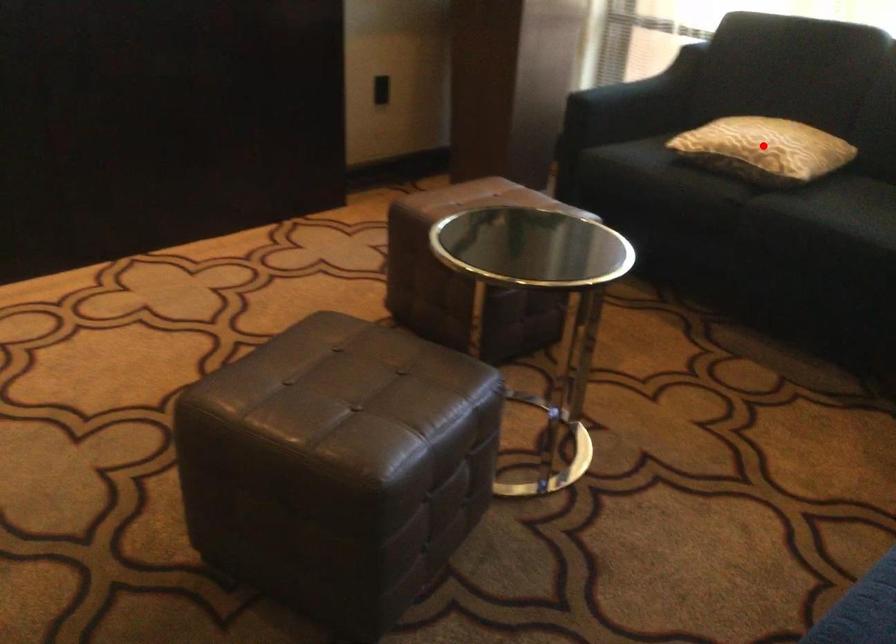
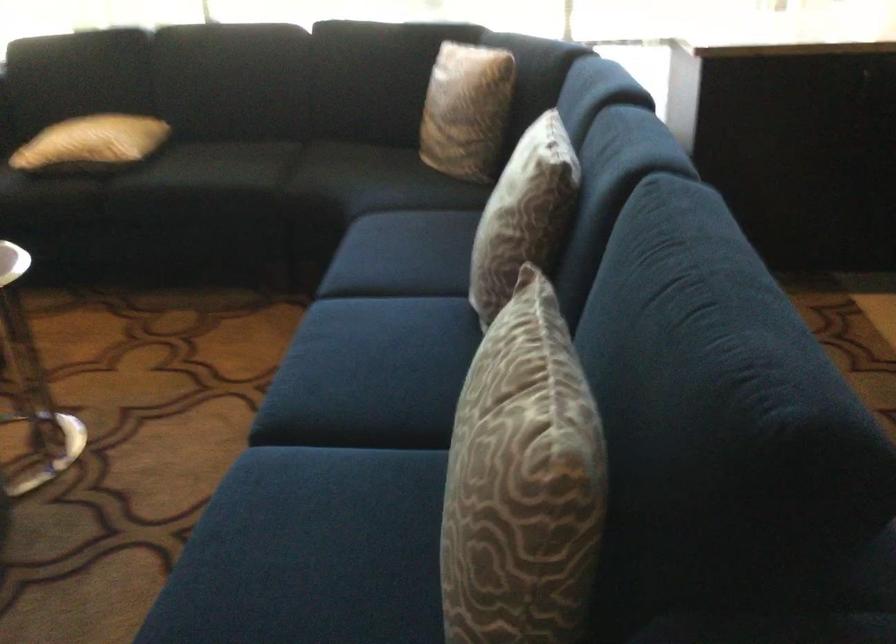
The point at the highlighted location is marked in the first image. Where is the corresponding point in the second image?

(91, 142)